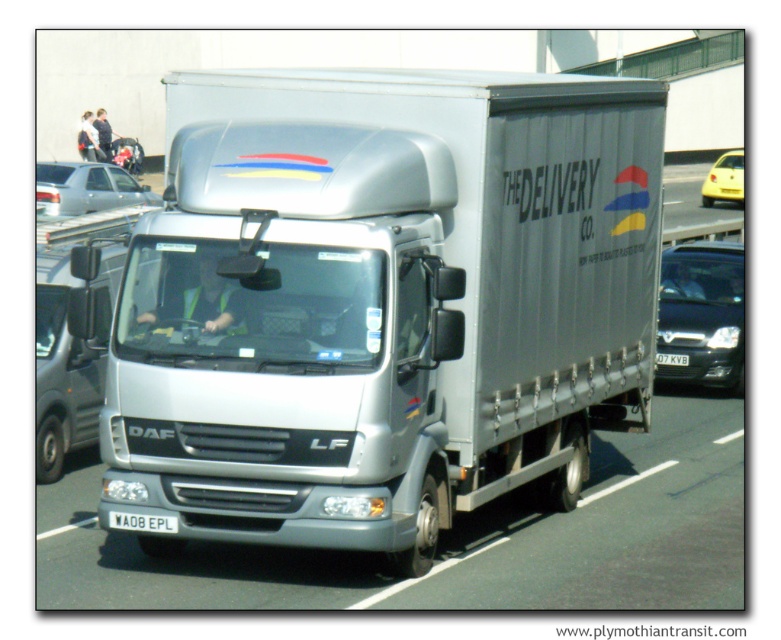
You are a delivery driver needing to park your silver DAF LF delivery truck. The parking spot is narrow, and you must ensure there is enough space between the black glossy car at right and the whiteplasticlicense plate at center. Can you fit your truck if it requires at least 1 meter of space?

The distance between the black glossy car at right and the whiteplasticlicense plate at center is 1.09 meters, which is more than the required 1 meter. Therefore, the truck can fit in the space.

You are standing at the center of the road and see a point marked at coordinates (701, 314). What object is located at that point?

The point at coordinates (701, 314) marks the black glossy car at right.

You are standing at the side of the road and see the silver DAF LF delivery truck and the black glossy car at right. If you want to cross the road safely, which vehicle is closer to you?

The black glossy car at right is closer to you since it is only 17.36 meters away from the viewer, while the silver DAF LF delivery truck is farther away.